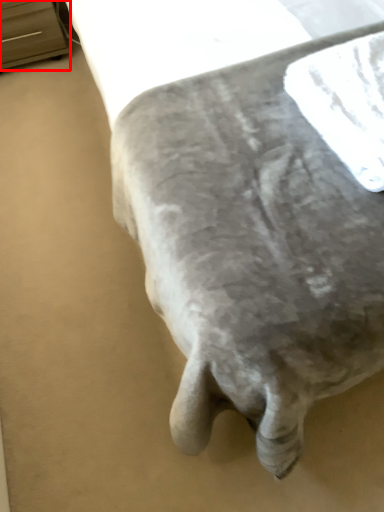
Question: From the image's perspective, considering the relative positions of furniture (annotated by the red box) and linen in the image provided, where is furniture (annotated by the red box) located with respect to the staircase?

Choices:
 (A) below
 (B) above

Answer: (B)